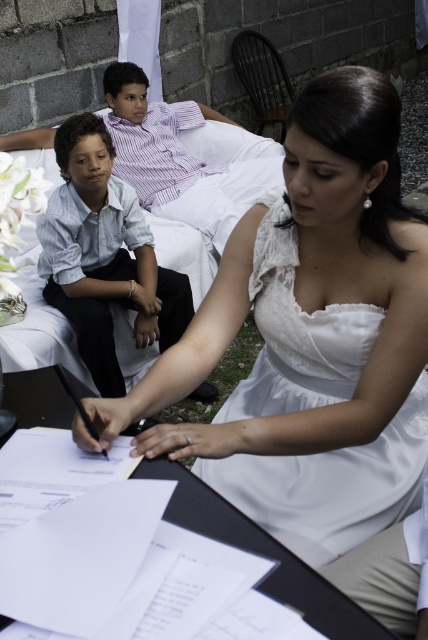
You are a guest at a formal event and need to place a striped cotton shirt at left on top of the white paper at center. Will the shirt cover the entire paper?

The white paper at center has a lesser width compared to striped cotton shirt at left, so placing the striped cotton shirt at left on top would fully cover the white paper at center.